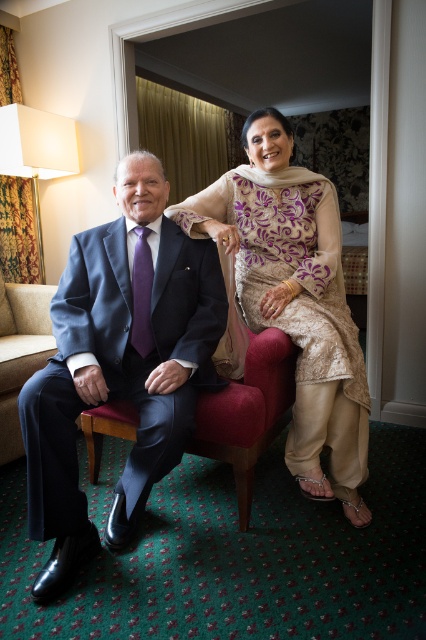
Question: Is matte blue suit at left bigger than beige lace dress at center?

Choices:
 (A) no
 (B) yes

Answer: (A)

Question: Which point appears closest to the camera in this image?

Choices:
 (A) (46, 317)
 (B) (268, 300)
 (C) (157, 248)

Answer: (C)

Question: Which point appears farthest from the camera in this image?

Choices:
 (A) click(58, 512)
 (B) click(22, 364)
 (C) click(224, 193)

Answer: (B)

Question: Is matte blue suit at left in front of suede couch at lower left?

Choices:
 (A) yes
 (B) no

Answer: (A)

Question: Which of these objects is positioned closest to the suede couch at lower left?

Choices:
 (A) beige lace dress at center
 (B) matte blue suit at left

Answer: (B)

Question: Is beige lace dress at center wider than suede couch at lower left?

Choices:
 (A) no
 (B) yes

Answer: (B)